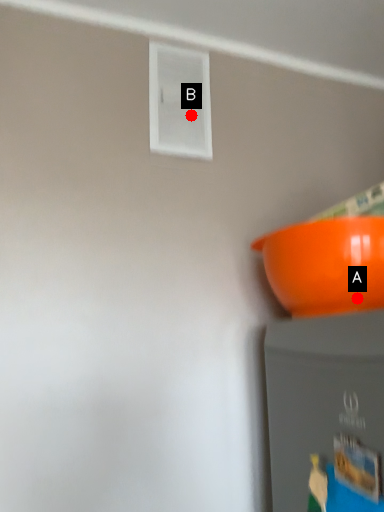
Question: Two points are circled on the image, labeled by A and B beside each circle. Which point is closer to the camera?

Choices:
 (A) A is closer
 (B) B is closer

Answer: (A)